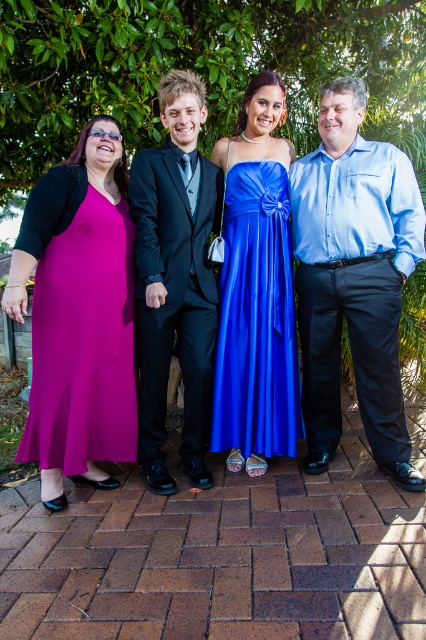
Question: Which object is the closest to the blue shirt at right?

Choices:
 (A) shiny black suit at center
 (B) satin blue dress at center

Answer: (B)

Question: Which point is farther to the camera?

Choices:
 (A) shiny black suit at center
 (B) matte blue dress at center
 (C) blue shirt at right
 (D) satin blue dress at center

Answer: (D)

Question: In this image, where is green leafy tree at upper center located relative to satin blue dress at center?

Choices:
 (A) left
 (B) right

Answer: (A)

Question: Is the position of matte blue dress at center less distant than that of blue shirt at right?

Choices:
 (A) yes
 (B) no

Answer: (A)

Question: Is shiny black suit at center to the right of satin blue dress at center from the viewer's perspective?

Choices:
 (A) no
 (B) yes

Answer: (A)

Question: Among these points, which one is nearest to the camera?

Choices:
 (A) coord(235,285)
 (B) coord(9,80)
 (C) coord(394,352)
 (D) coord(267,106)

Answer: (C)